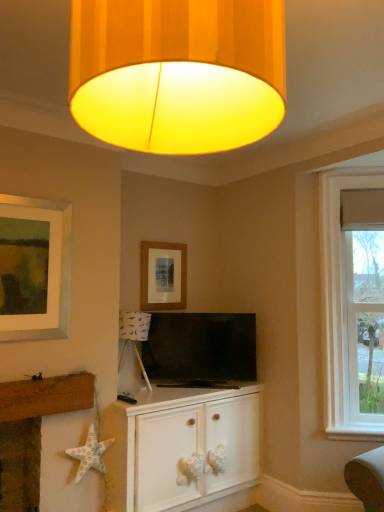
Question: Can you confirm if clear glass window at right is shorter than matte wooden picture frame at upper center?

Choices:
 (A) no
 (B) yes

Answer: (A)

Question: Is clear glass window at right not near matte wooden picture frame at upper center?

Choices:
 (A) yes
 (B) no

Answer: (A)

Question: From a real-world perspective, is clear glass window at right located higher than matte wooden picture frame at upper center?

Choices:
 (A) no
 (B) yes

Answer: (A)

Question: Does clear glass window at right appear on the right side of matte wooden picture frame at upper center?

Choices:
 (A) no
 (B) yes

Answer: (B)

Question: From the image's perspective, does clear glass window at right appear lower than matte wooden picture frame at upper center?

Choices:
 (A) yes
 (B) no

Answer: (A)

Question: Does point (137, 434) appear closer or farther from the camera than point (279, 82)?

Choices:
 (A) closer
 (B) farther

Answer: (B)

Question: From a real-world perspective, is white wood cabinet at center above or below yellow fabric lampshade at upper center?

Choices:
 (A) below
 (B) above

Answer: (A)

Question: From the image's perspective, is white wood cabinet at center positioned above or below yellow fabric lampshade at upper center?

Choices:
 (A) above
 (B) below

Answer: (B)

Question: In the image, is white wood cabinet at center positioned in front of or behind yellow fabric lampshade at upper center?

Choices:
 (A) behind
 (B) front

Answer: (A)

Question: Is yellow fabric lampshade at upper center wider or thinner than white fabric starfish at lower left?

Choices:
 (A) wide
 (B) thin

Answer: (A)

Question: From a real-world perspective, relative to white fabric starfish at lower left, is yellow fabric lampshade at upper center vertically above or below?

Choices:
 (A) below
 (B) above

Answer: (B)

Question: Based on their positions, is yellow fabric lampshade at upper center located to the left or right of white fabric starfish at lower left?

Choices:
 (A) right
 (B) left

Answer: (A)

Question: Is yellow fabric lampshade at upper center situated inside white fabric starfish at lower left or outside?

Choices:
 (A) inside
 (B) outside

Answer: (B)

Question: Is clear glass window at right taller or shorter than white wood cabinet at center?

Choices:
 (A) tall
 (B) short

Answer: (A)

Question: Is clear glass window at right in front of or behind white wood cabinet at center in the image?

Choices:
 (A) front
 (B) behind

Answer: (B)